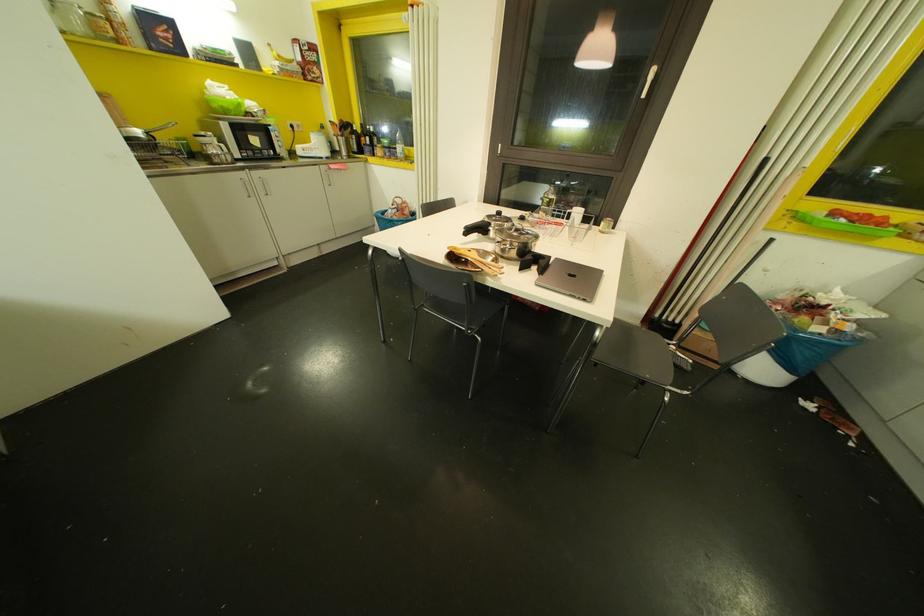
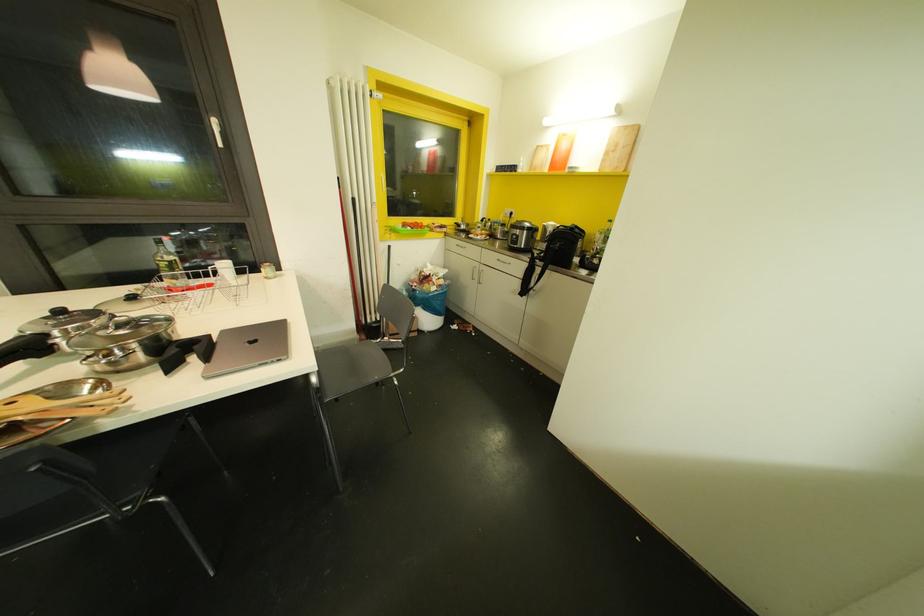
Locate, in the second image, the point that corresponds to [513,225] in the first image.

(113, 317)